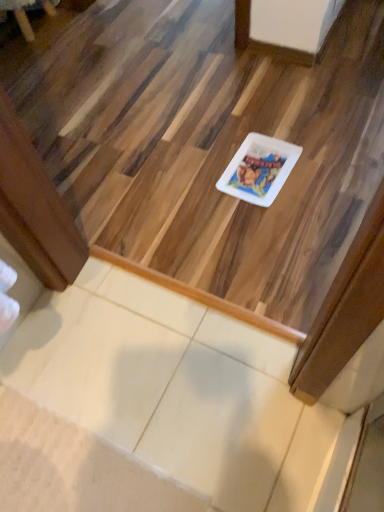
Question: Is white glossy plate at center aimed at brushed metal table at upper left?

Choices:
 (A) no
 (B) yes

Answer: (A)

Question: From a real-world perspective, is white glossy plate at center physically below brushed metal table at upper left?

Choices:
 (A) no
 (B) yes

Answer: (B)

Question: Does white glossy plate at center appear on the left side of brushed metal table at upper left?

Choices:
 (A) no
 (B) yes

Answer: (A)

Question: Is brushed metal table at upper left a part of white glossy plate at center?

Choices:
 (A) no
 (B) yes

Answer: (A)

Question: From the image's perspective, does white glossy plate at center appear lower than brushed metal table at upper left?

Choices:
 (A) no
 (B) yes

Answer: (B)

Question: From the image's perspective, is white glossy plate at center located above brushed metal table at upper left?

Choices:
 (A) yes
 (B) no

Answer: (B)

Question: Considering the relative sizes of white glossy plate at center and white glossy plate at center in the image provided, is white glossy plate at center shorter than white glossy plate at center?

Choices:
 (A) no
 (B) yes

Answer: (A)

Question: Does white glossy plate at center lie in front of white glossy plate at center?

Choices:
 (A) yes
 (B) no

Answer: (A)

Question: From the image's perspective, does white glossy plate at center appear higher than white glossy plate at center?

Choices:
 (A) yes
 (B) no

Answer: (A)

Question: Can you confirm if white glossy plate at center is bigger than white glossy plate at center?

Choices:
 (A) no
 (B) yes

Answer: (B)

Question: From a real-world perspective, is white glossy plate at center positioned over white glossy plate at center based on gravity?

Choices:
 (A) no
 (B) yes

Answer: (B)

Question: Does white glossy plate at center have a lesser width compared to white glossy plate at center?

Choices:
 (A) yes
 (B) no

Answer: (B)

Question: From a real-world perspective, is white glossy plate at center over white glossy plate at center?

Choices:
 (A) yes
 (B) no

Answer: (B)